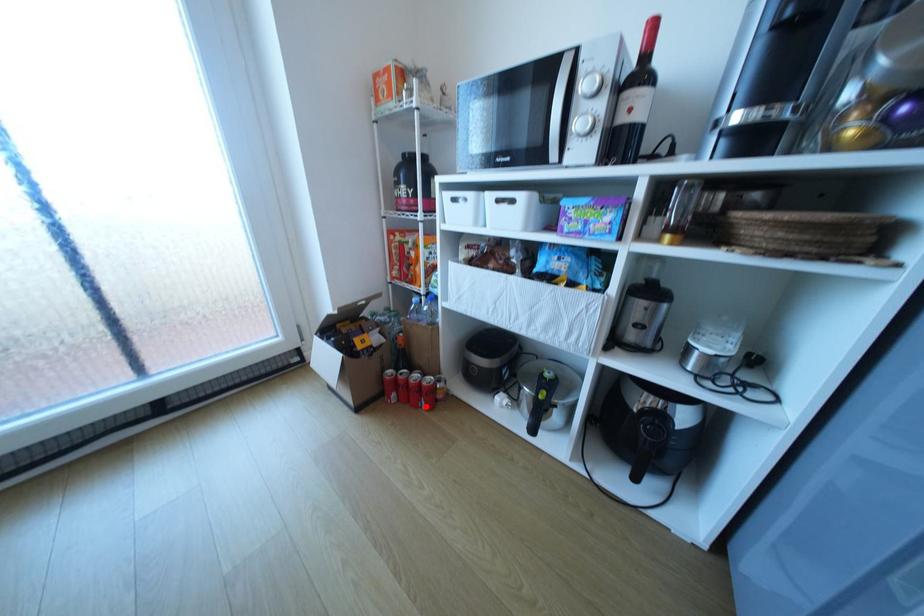
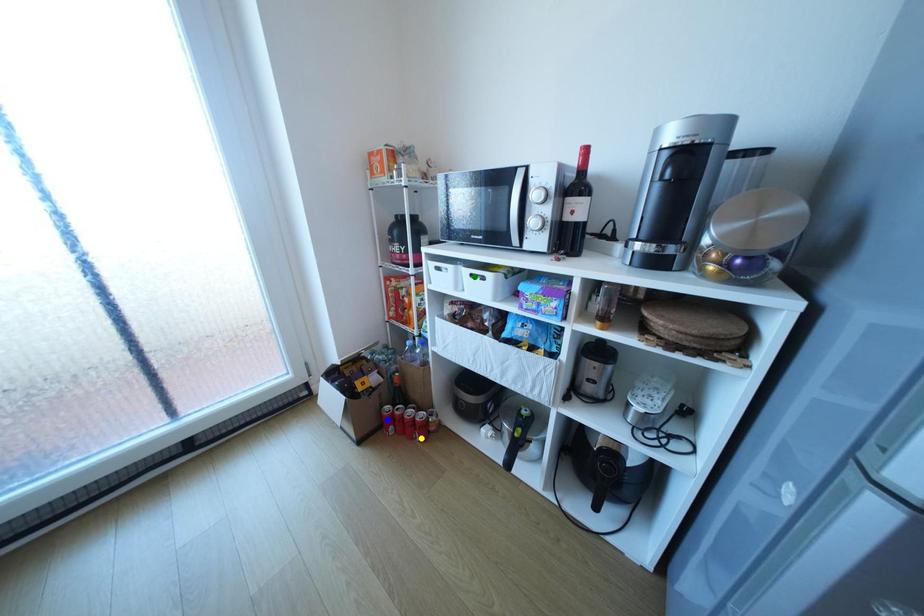
Question: I am providing you with two images of the same scene from different viewpoints. A red point is marked on the first image. You are given multiple points on the second image. Which mark in image 2 goes with the point in image 1?

Choices:
 (A) green point
 (B) yellow point
 (C) blue point

Answer: (B)